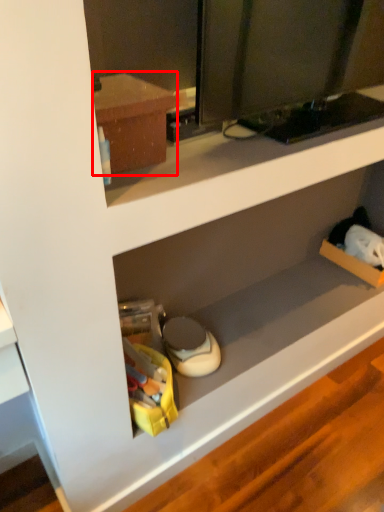
Question: From the image's perspective, what is the correct spatial relationship of cabinetry (annotated by the red box) in relation to shelf?

Choices:
 (A) below
 (B) above

Answer: (B)